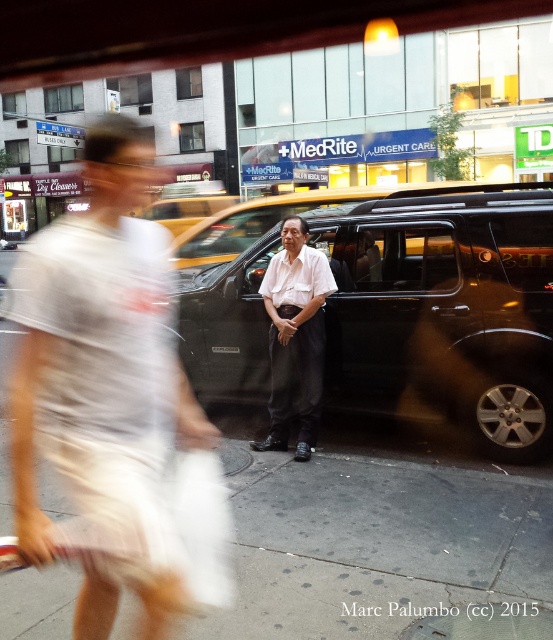
Is point (205, 445) closer to camera compared to point (399, 188)?

Yes, it is.

Can you confirm if white cotton dress at center is positioned below yellow metallic taxi at center?

Yes.

Find the location of a particular element. This screenshot has width=553, height=640. white cotton dress at center is located at coordinates (114, 404).

Which is more to the left, gray concrete sidewalk at center or yellow metallic taxi at center?

gray concrete sidewalk at center

Who is more forward, (410, 580) or (207, 241)?

Point (410, 580) is in front.

Find the location of a particular element. This screenshot has height=640, width=553. gray concrete sidewalk at center is located at coordinates [380, 538].

Is the position of white cotton dress at center more distant than that of gray concrete sidewalk at center?

That is False.

Does white cotton dress at center have a lesser height compared to gray concrete sidewalk at center?

Incorrect, white cotton dress at center's height does not fall short of gray concrete sidewalk at center's.

From the picture: Measure the distance between point (127,164) and camera.

6.65 feet

In order to click on white cotton dress at center in this screenshot , I will do `click(114, 404)`.